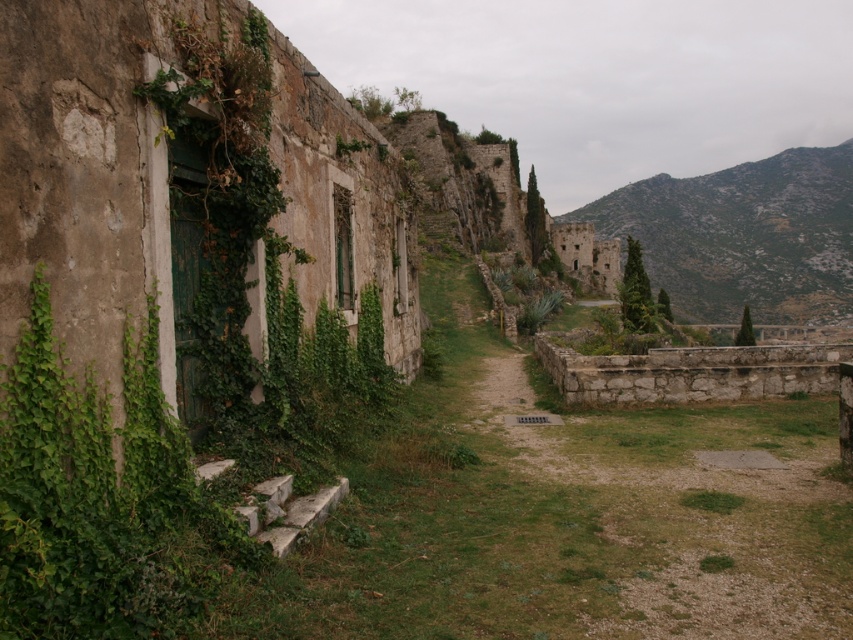
You are standing at the point marked by the coordinates point (100,499) in the image of the old building. Which object from the scene is directly beneath your feet?

The point (100,499) is on green ivy at left, so the object directly beneath your feet is the green ivy at left.

You are standing at the old building and want to walk to the stone along the pathway. Which point, point [166,499] or point [700,298], is closer to the stone?

Point [166,499] is closer to the stone because it is in front of point [700,298] along the pathway.

You are standing at the base of the rugged stone hillside at upper right and want to take a photo of the old building. The camera you have can only focus on objects within 400 meters. Will the camera be able to capture the building clearly?

The rugged stone hillside at upper right and camera are 445.37 meters apart, which exceeds the camera focus range of 400 meters. Therefore, the camera cannot capture the building clearly.